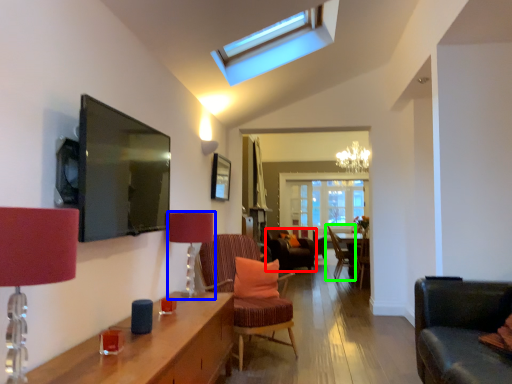
Question: Which object is positioned farthest from chair (highlighted by a red box)? Select from table lamp (highlighted by a blue box) and chair (highlighted by a green box).

Choices:
 (A) table lamp
 (B) chair

Answer: (A)